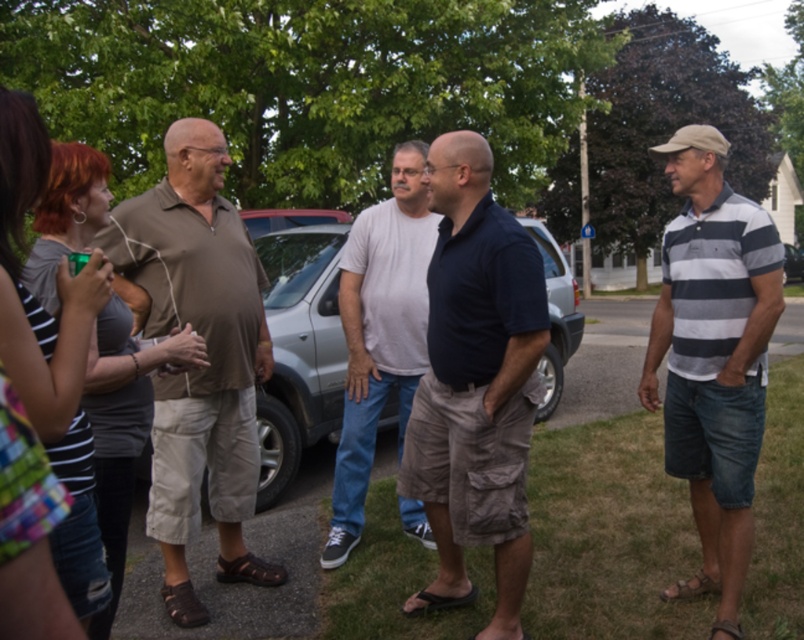
Question: Which point appears farthest from the camera in this image?

Choices:
 (A) pos(203,424)
 (B) pos(458,600)

Answer: (A)

Question: Is dark blue cotton polo shirt at center positioned in front of matte brown shirt at left?

Choices:
 (A) yes
 (B) no

Answer: (A)

Question: Which object is positioned farthest from the striped cotton polo shirt at right?

Choices:
 (A) silver metallic suv at center
 (B) metallic silver car at center

Answer: (B)

Question: Is matte brown shirt at left to the left of striped cotton polo shirt at right from the viewer's perspective?

Choices:
 (A) yes
 (B) no

Answer: (A)

Question: Is matte brown shirt at left in front of silver metallic suv at center?

Choices:
 (A) no
 (B) yes

Answer: (B)

Question: Estimate the real-world distances between objects in this image. Which object is closer to the matte brown shirt at left?

Choices:
 (A) dark blue cotton polo shirt at center
 (B) metallic silver car at center

Answer: (A)